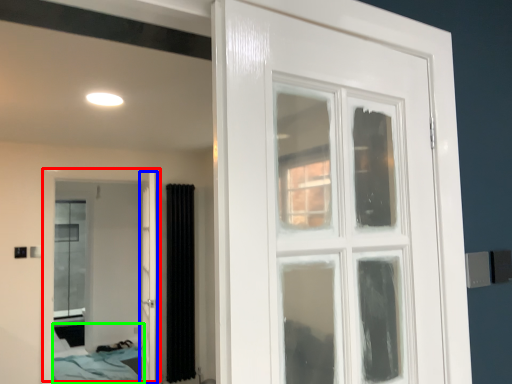
Question: Which is farther away from door (highlighted by a red box)? door (highlighted by a blue box) or bed (highlighted by a green box)?

Choices:
 (A) door
 (B) bed

Answer: (A)